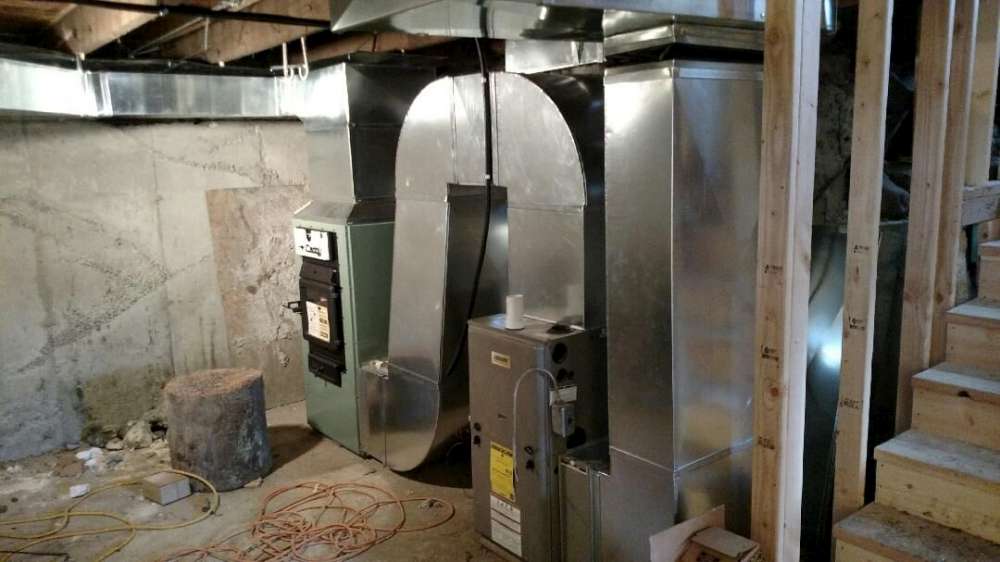
You are a GUI agent. You are given a task and a screenshot of the screen. Output one action in this format:
    pyautogui.click(x=<x>, y=<y>)
    Task: Click on the light reflecting on vent system
    This screenshot has height=562, width=1000.
    Given the screenshot: What is the action you would take?
    pyautogui.click(x=31, y=92), pyautogui.click(x=325, y=90), pyautogui.click(x=644, y=93), pyautogui.click(x=438, y=97)